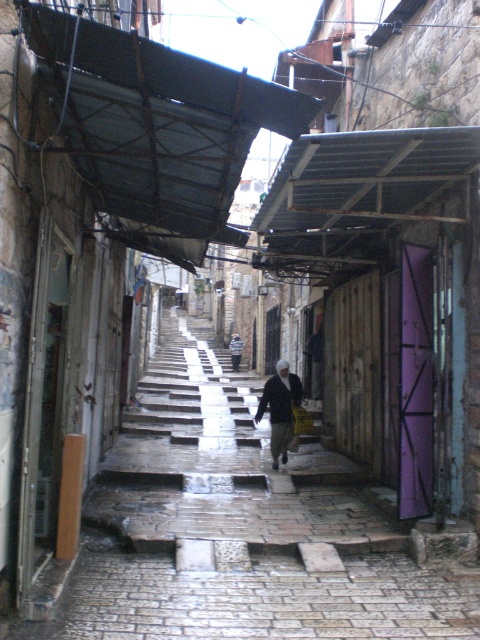
From the picture: You are standing in the alleyway and want to place a small potted plant between the two points, point [213,134] and point [235,339]. Which point should the plant be closer to in order to be nearer to the viewer?

The plant should be placed closer to point [213,134] because it is closer to the viewer than point [235,339].

You are a drone operator trying to navigate a small drone through the narrow alleyway. The drone has a maximum height limit of 0.3 meters. You need to fly it under the metallic corrugated roof at upper center located at point 0.189, 0.325. Can the drone safely pass under the roof without exceeding its height limit?

The metallic corrugated roof at upper center is positioned at point (156, 120). Since the drone has a maximum height limit of 0.3 meters, and the roof is at 0.325 meters, the drone cannot safely pass under the roof without exceeding its height limit.

In the scene shown: You are standing in the alleyway and want to walk towards the point that is closer to you. Which point should you walk towards, point (260, 410) or point (235, 342)?

You should walk towards point (260, 410) because it is closer to the viewer than point (235, 342).